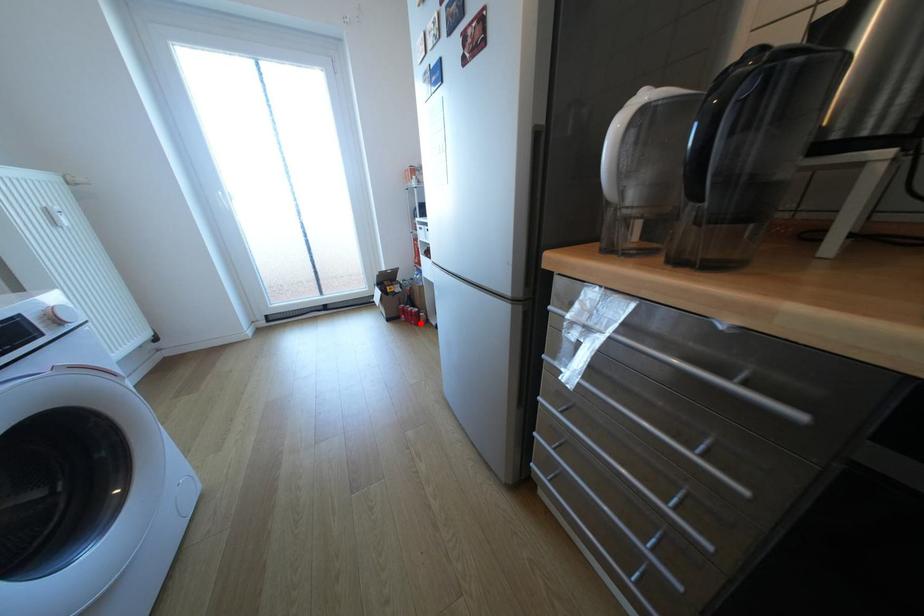
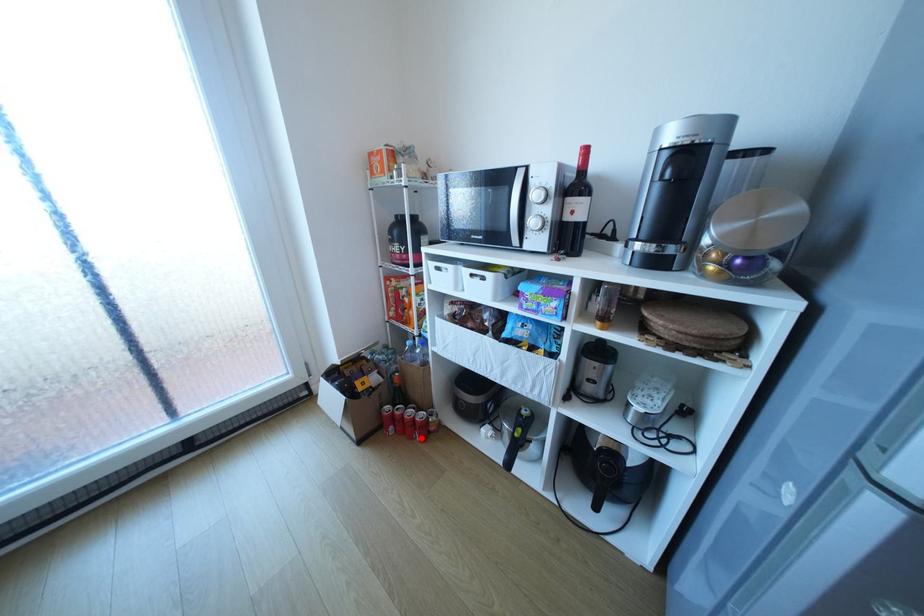
I am providing you with two images of the same scene from different viewpoints. A red point is marked on the first image and another point is marked on the second image. Do the highlighted points in image1 and image2 indicate the same real-world spot?

Yes